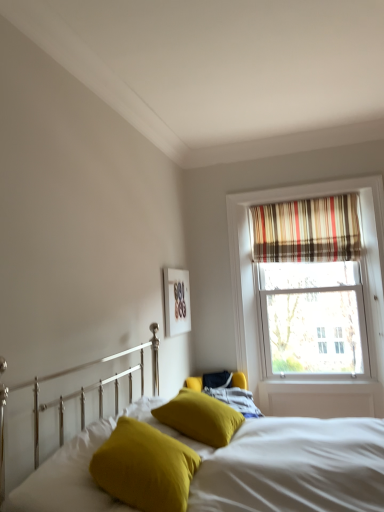
Question: Is mustard yellow fabric pillow at lower center, which ranks as the second pillow in left-to-right order, far away from matte white picture frame at upper center?

Choices:
 (A) yes
 (B) no

Answer: (A)

Question: Is matte white picture frame at upper center at the back of mustard yellow fabric pillow at lower center, which ranks as the second pillow in right-to-left order?

Choices:
 (A) no
 (B) yes

Answer: (A)

Question: From a real-world perspective, is mustard yellow fabric pillow at lower center, which ranks as the second pillow in right-to-left order, located beneath matte white picture frame at upper center?

Choices:
 (A) yes
 (B) no

Answer: (A)

Question: From the image's perspective, would you say mustard yellow fabric pillow at lower center, which ranks as the second pillow in left-to-right order, is shown under matte white picture frame at upper center?

Choices:
 (A) no
 (B) yes

Answer: (B)

Question: Can you confirm if mustard yellow fabric pillow at lower center, which ranks as the second pillow in right-to-left order, is wider than matte white picture frame at upper center?

Choices:
 (A) no
 (B) yes

Answer: (B)

Question: Is mustard yellow fabric pillow at lower center, which ranks as the second pillow in left-to-right order, taller or shorter than striped fabric curtain at upper right?

Choices:
 (A) tall
 (B) short

Answer: (B)

Question: From the image's perspective, is mustard yellow fabric pillow at lower center, which ranks as the second pillow in left-to-right order, above or below striped fabric curtain at upper right?

Choices:
 (A) below
 (B) above

Answer: (A)

Question: Which is correct: mustard yellow fabric pillow at lower center, which ranks as the second pillow in right-to-left order, is inside striped fabric curtain at upper right, or outside of it?

Choices:
 (A) inside
 (B) outside

Answer: (B)

Question: Considering the positions of point (105, 449) and point (299, 232), is point (105, 449) closer or farther from the camera than point (299, 232)?

Choices:
 (A) closer
 (B) farther

Answer: (A)

Question: Is striped fabric curtain at upper right wider or thinner than mustard yellow fabric pillow at center, which is counted as the 1th pillow, starting from the right?

Choices:
 (A) thin
 (B) wide

Answer: (A)

Question: Do you think striped fabric curtain at upper right is within mustard yellow fabric pillow at center, positioned as the 3th pillow in left-to-right order, or outside of it?

Choices:
 (A) outside
 (B) inside

Answer: (A)

Question: Considering the positions of point (286, 234) and point (162, 404), is point (286, 234) closer or farther from the camera than point (162, 404)?

Choices:
 (A) closer
 (B) farther

Answer: (B)

Question: Considering the relative positions of striped fabric curtain at upper right and mustard yellow fabric pillow at center, positioned as the 3th pillow in left-to-right order, in the image provided, is striped fabric curtain at upper right to the left or to the right of mustard yellow fabric pillow at center, positioned as the 3th pillow in left-to-right order,?

Choices:
 (A) right
 (B) left

Answer: (A)

Question: Considering their positions, is velvety yellow pillow at lower left, which is the 1th pillow from left to right, located in front of or behind velvet yellow pillows at center?

Choices:
 (A) behind
 (B) front

Answer: (A)

Question: Considering the positions of point (23, 493) and point (326, 498), is point (23, 493) closer or farther from the camera than point (326, 498)?

Choices:
 (A) farther
 (B) closer

Answer: (B)